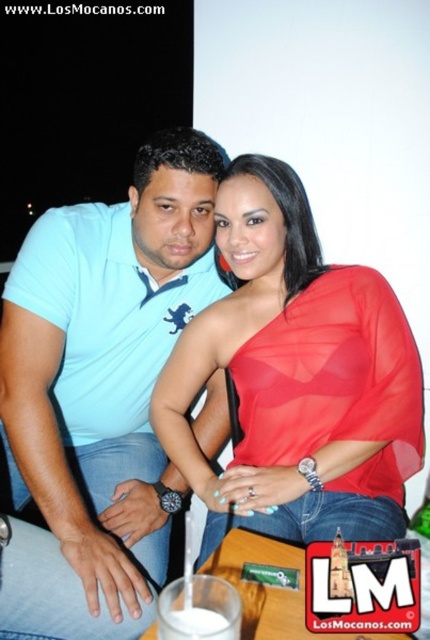
You are taking a photo of two people standing side by side. You notice the light blue cotton shirt at center and the shiny red blouse at center. Which clothing item is positioned closer to the camera?

The light blue cotton shirt at center is closer to the viewer than the shiny red blouse at center, so the light blue cotton shirt at center is positioned closer to the camera.

You are a photographer trying to adjust the lighting for a photo shoot. You notice the light blue cotton shirt at center and the shiny red blouse at center. Which clothing item should you focus on first to ensure proper exposure, considering their height in the frame?

The light blue cotton shirt at center is taller than the shiny red blouse at center, so you should focus on the light blue cotton shirt at center first to ensure proper exposure since it occupies a larger portion of the frame.

You are taking a photo of two people standing in front of you. You notice two specific points on their clothing that you want to focus on. The first point is located at coordinates point (224, 157) and the second point is at point (408, 381). Which of these two points is closer to the camera?

Point (224, 157) is behind point (408, 381), so the point closer to the camera is point (408, 381).